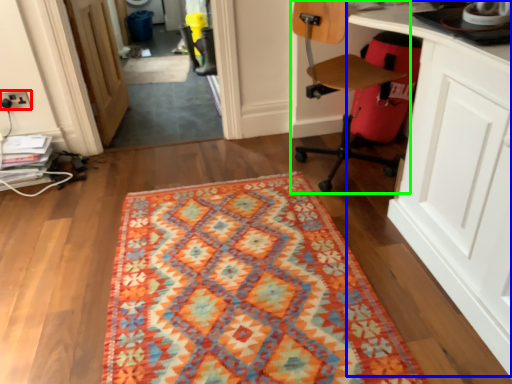
Question: Which is nearer to the electric outlet (highlighted by a red box)? computer desk (highlighted by a blue box) or chair (highlighted by a green box).

Choices:
 (A) computer desk
 (B) chair

Answer: (B)